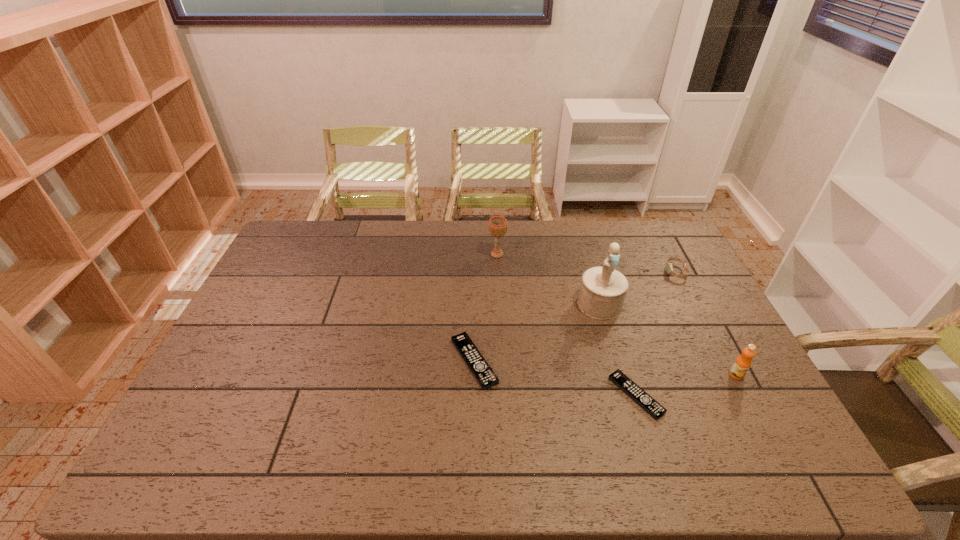
Find the location of a particular element. The image size is (960, 540). the left remote control is located at coordinates (479, 367).

You are a GUI agent. You are given a task and a screenshot of the screen. Output one action in this format:
    pyautogui.click(x=<x>, y=<y>)
    Task: Click on the taller remote control
    Image resolution: width=960 pixels, height=540 pixels.
    Given the screenshot: What is the action you would take?
    pyautogui.click(x=479, y=367)

Image resolution: width=960 pixels, height=540 pixels. In order to click on the right remote control in this screenshot , I will do `click(644, 400)`.

At what (x,y) coordinates should I click in order to perform the action: click on the shorter remote control. Please return your answer as a coordinate pair (x, y). This screenshot has height=540, width=960. Looking at the image, I should click on (644, 400).

Locate an element on the screen. This screenshot has height=540, width=960. chalice is located at coordinates [497, 225].

Locate an element on the screen. This screenshot has height=540, width=960. the second tallest object is located at coordinates (497, 225).

At what (x,y) coordinates should I click in order to perform the action: click on the second farthest object. Please return your answer as a coordinate pair (x, y). Image resolution: width=960 pixels, height=540 pixels. Looking at the image, I should click on (669, 268).

This screenshot has height=540, width=960. Identify the location of watch. (669, 268).

Locate an element on the screen. This screenshot has height=540, width=960. the fourth nearest object is located at coordinates (603, 289).

Where is `figurine`? figurine is located at coordinates (603, 289).